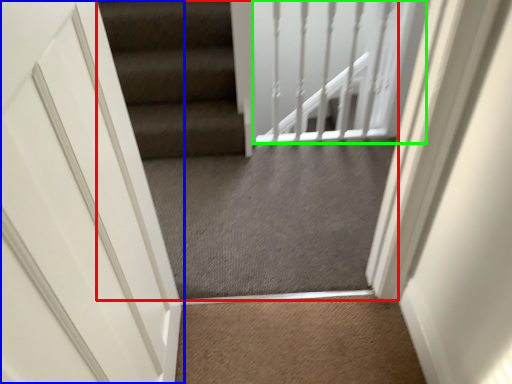
Question: Which object is the closest to the escalator (highlighted by a red box)? Choose among these: door (highlighted by a blue box) or balustrade (highlighted by a green box).

Choices:
 (A) door
 (B) balustrade

Answer: (B)